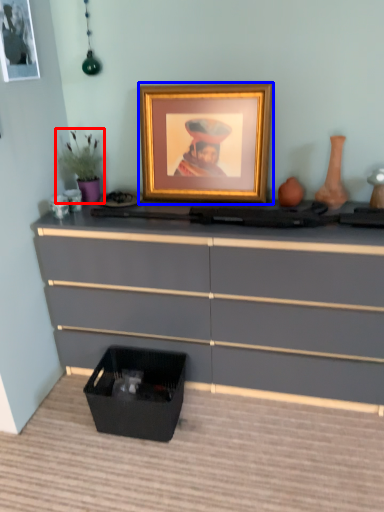
Question: Among these objects, which one is farthest to the camera, houseplant (highlighted by a red box) or picture frame (highlighted by a blue box)?

Choices:
 (A) houseplant
 (B) picture frame

Answer: (A)